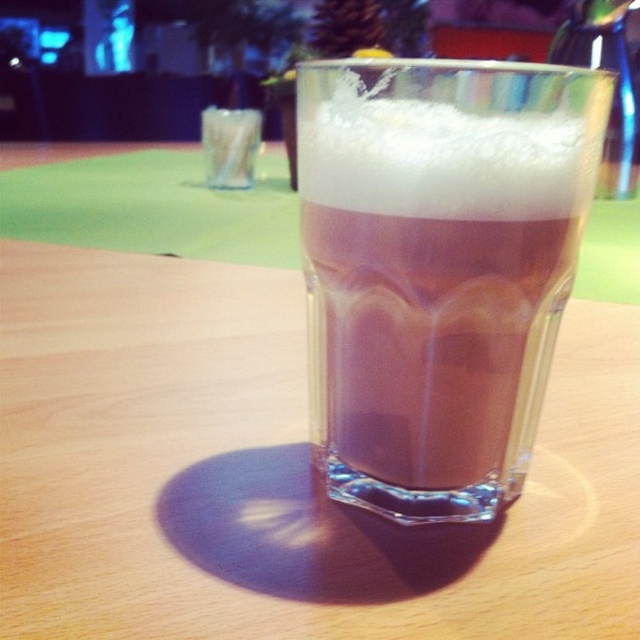
Question: Estimate the real-world distances between objects in this image. Which object is farther from the white fluffy foam at center?

Choices:
 (A) brown frothy beverage at center
 (B) green fuzzy pine cone at upper center

Answer: (B)

Question: Which object is the closest to the brown frothy beverage at center?

Choices:
 (A) white fluffy foam at center
 (B) green fuzzy pine cone at upper center

Answer: (A)

Question: Can you confirm if brown frothy beverage at center is positioned to the right of green fuzzy pine cone at upper center?

Choices:
 (A) no
 (B) yes

Answer: (B)

Question: Can you confirm if brown frothy beverage at center is smaller than green fuzzy pine cone at upper center?

Choices:
 (A) yes
 (B) no

Answer: (A)

Question: Considering the real-world distances, which object is farthest from the white fluffy foam at center?

Choices:
 (A) green fuzzy pine cone at upper center
 (B) brown frothy beverage at center

Answer: (A)

Question: Does brown frothy beverage at center have a lesser width compared to green fuzzy pine cone at upper center?

Choices:
 (A) yes
 (B) no

Answer: (A)